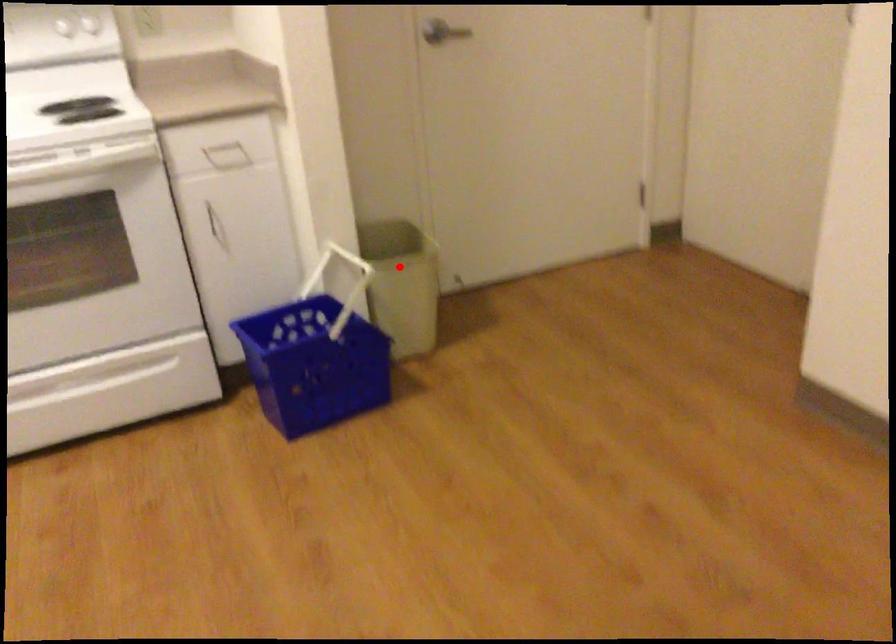
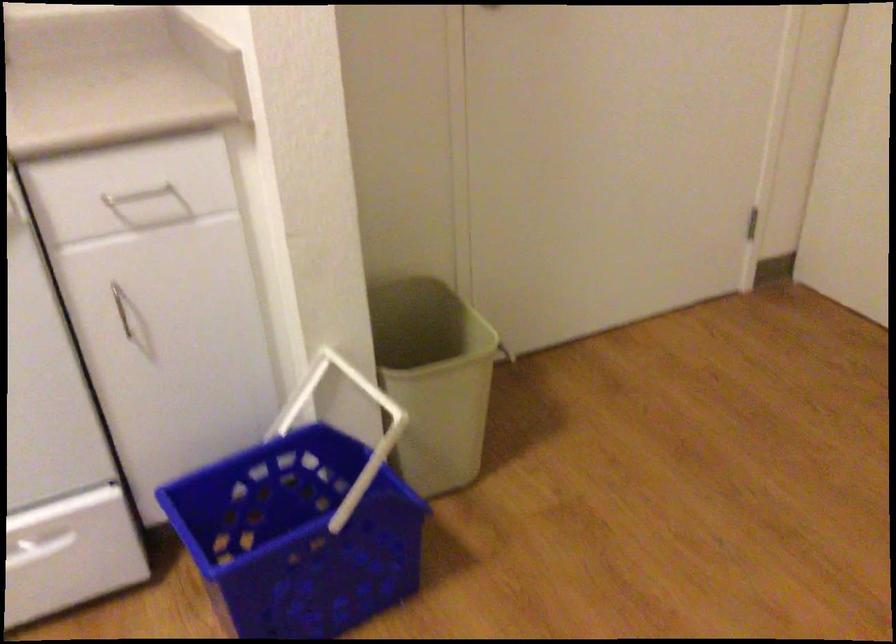
Find the pixel in the second image that matches the highlighted location in the first image.

(434, 379)